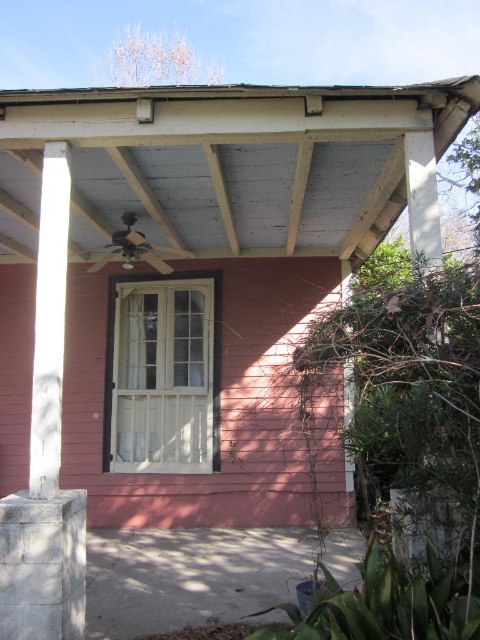
You are standing on the front porch of the house. You notice the wooden ceiling at center and the white painted wood beam at left. Which object is closer to you as you face the porch?

The wooden ceiling at center is closer to you because the white painted wood beam at left is behind it.

In the scene shown: You are standing on the front porch of the house and want to hang a decorative string light between the wooden ceiling at center and the white painted wood beam at left. Which object should you attach the light to first if you want the light to hang lower?

The wooden ceiling at center is shorter than the white painted wood beam at left, so you should attach the decorative string light to the white painted wood beam at left first to ensure the light hangs lower.

You are standing on the front porch of the house and want to hang a decorative lantern. You have two spots in mind between the wooden ceiling at center and the white painted wood beam at left. Which object should you choose to place the lantern to its right side?

You should place the lantern to the right side of the white painted wood beam at left because the wooden ceiling at center is located to the right of the white painted wood beam at left.